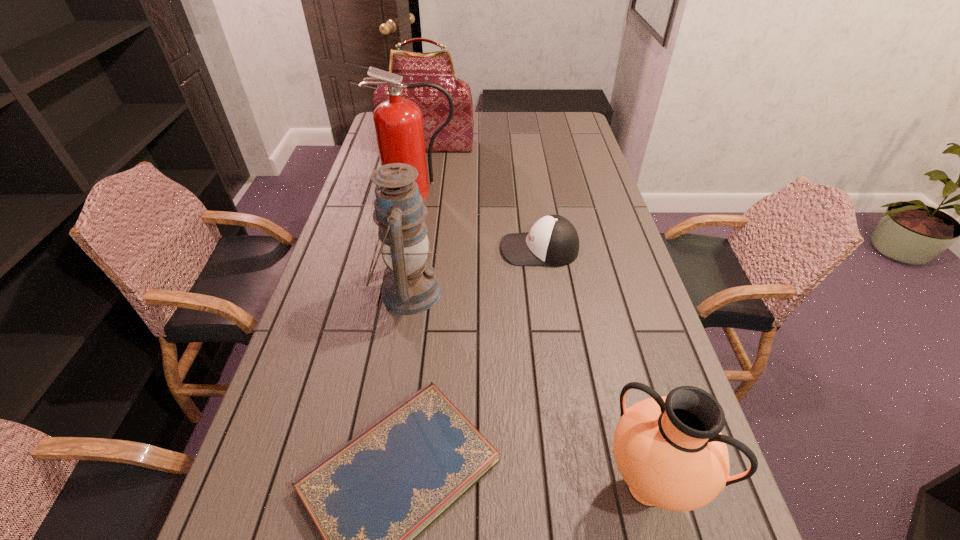
You are a GUI agent. You are given a task and a screenshot of the screen. Output one action in this format:
    pyautogui.click(x=<x>, y=<y>)
    Task: Click on the fire extinguisher that is at the left edge
    
    Given the screenshot: What is the action you would take?
    pyautogui.click(x=398, y=122)

Locate an element on the screen. The image size is (960, 540). handbag at the left edge is located at coordinates (437, 67).

I want to click on object that is at the right edge, so click(553, 241).

In the image, there is a desktop. Identify the location of vacant space at the left edge. This screenshot has height=540, width=960. (345, 261).

You are a GUI agent. You are given a task and a screenshot of the screen. Output one action in this format:
    pyautogui.click(x=<x>, y=<y>)
    Task: Click on the vacant position at the right edge of the desktop
    
    Given the screenshot: What is the action you would take?
    pyautogui.click(x=639, y=321)

In the image, there is a desktop. Identify the location of vacant space at the far right corner. (570, 128).

Locate an element on the screen. The image size is (960, 540). object that is the fifth closest one to the farthest object is located at coordinates (670, 451).

At what (x,y) coordinates should I click in order to perform the action: click on object that is the closest one to the cap. Please return your answer as a coordinate pair (x, y). Looking at the image, I should click on (410, 285).

Where is `vacant space that satisfies the following two spatial constraints: 1. with the handle and nozzle on the oil lamp; 2. on the left side of the fire extinguisher`? vacant space that satisfies the following two spatial constraints: 1. with the handle and nozzle on the oil lamp; 2. on the left side of the fire extinguisher is located at coordinates (400, 292).